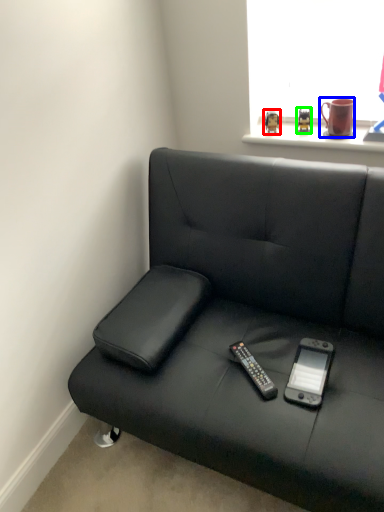
Question: Which object is the closest to the toy (highlighted by a red box)? Choose among these: mug (highlighted by a blue box) or toy (highlighted by a green box).

Choices:
 (A) mug
 (B) toy

Answer: (B)